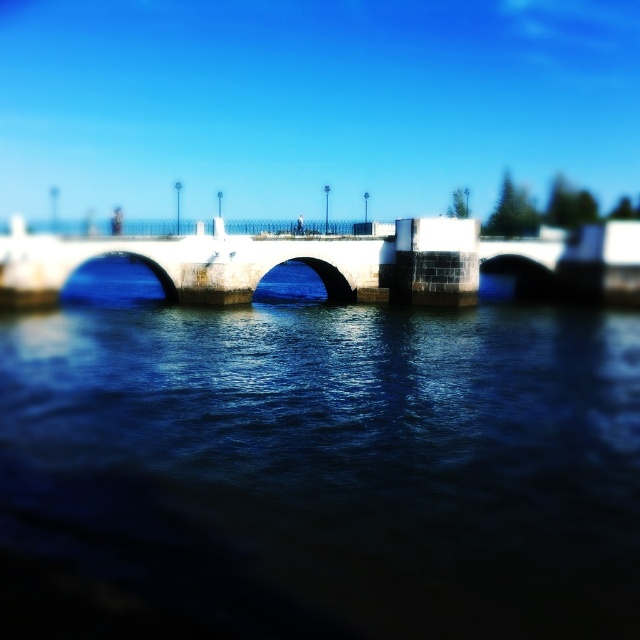
You are a photographer planning to capture the white stone bridge at center and the dark blue water at center in a single shot. Based on the scene, which object takes up more area in the image?

The white stone bridge at center takes up more area than the dark blue water at center in the image.

You are standing on the white stone bridge at center and want to see the dark blue water at center. In which direction should you look from the bridge?

You should look to the right from the white stone bridge at center to see the dark blue water at center, as the dark blue water at center is located to the right of the white stone bridge at center.